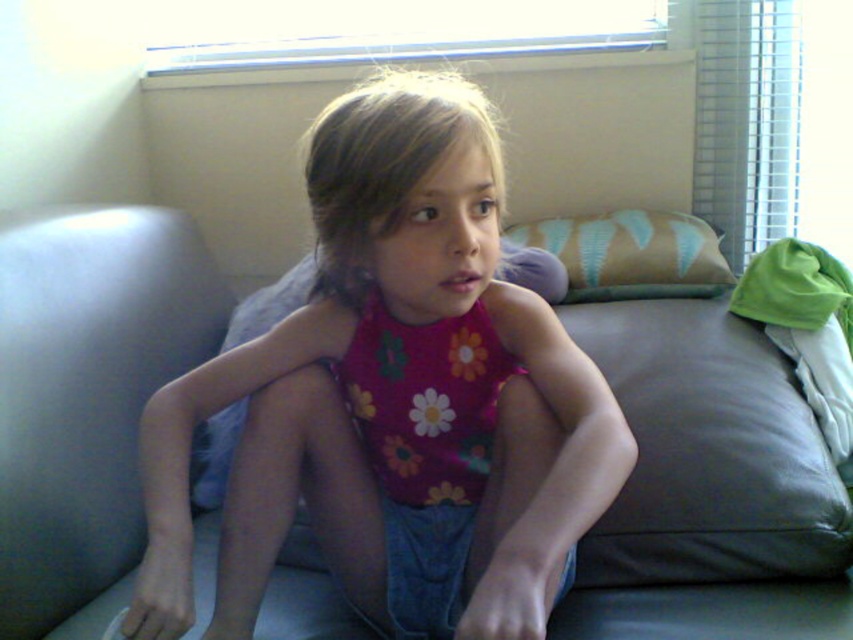
Does floral tank top at center have a smaller size compared to beige fabric pillow at upper right?

Incorrect, floral tank top at center is not smaller in size than beige fabric pillow at upper right.

The image size is (853, 640). What do you see at coordinates (395, 400) in the screenshot?
I see `floral tank top at center` at bounding box center [395, 400].

This screenshot has width=853, height=640. In order to click on floral tank top at center in this screenshot , I will do point(395,400).